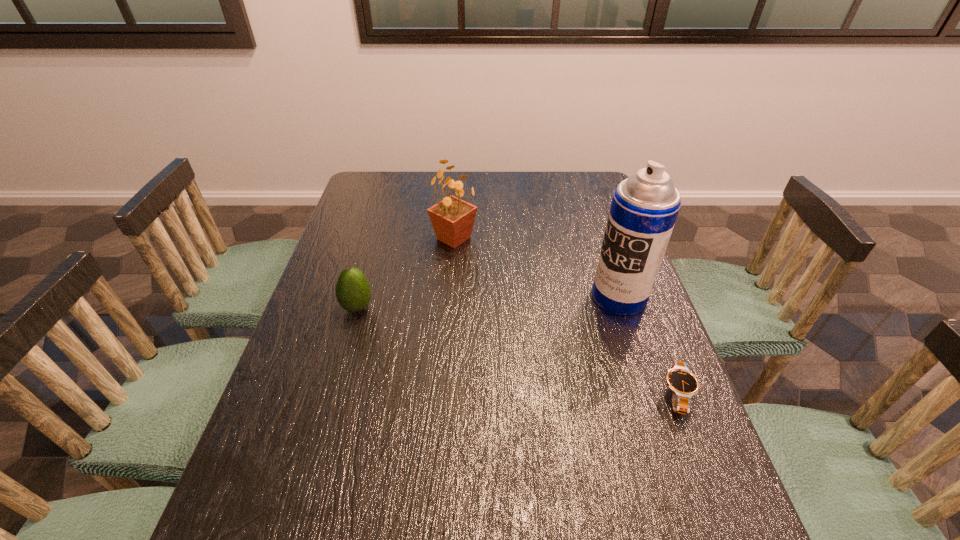
Locate an element on the screen. The width and height of the screenshot is (960, 540). free area in between the second shortest object and the sunflower is located at coordinates (405, 273).

The image size is (960, 540). Identify the location of vacant point located between the shortest object and the third object from right to left. (565, 316).

You are a GUI agent. You are given a task and a screenshot of the screen. Output one action in this format:
    pyautogui.click(x=<x>, y=<y>)
    Task: Click on the free space between the aerosol can and the third tallest object
    
    Given the screenshot: What is the action you would take?
    pyautogui.click(x=488, y=302)

Image resolution: width=960 pixels, height=540 pixels. I want to click on the closest object to the avocado, so click(452, 219).

You are a GUI agent. You are given a task and a screenshot of the screen. Output one action in this format:
    pyautogui.click(x=<x>, y=<y>)
    Task: Click on the closest object relative to the leftmost object
    
    Given the screenshot: What is the action you would take?
    452,219

Find the location of a particular element. The height and width of the screenshot is (540, 960). vacant area that satisfies the following two spatial constraints: 1. on the front side of the aerosol can; 2. on the right side of the watch is located at coordinates click(x=651, y=394).

In order to click on vacant position in the image that satisfies the following two spatial constraints: 1. on the back side of the farthest object; 2. on the left side of the leftmost object in this screenshot , I will do `click(377, 238)`.